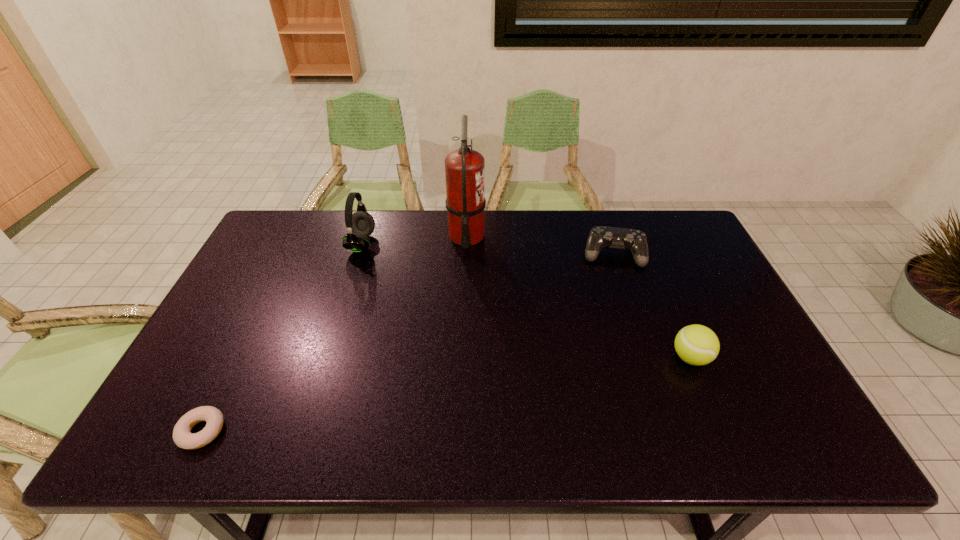
Locate an element on the screen. The width and height of the screenshot is (960, 540). free space located on the ear cups of the fourth object from right to left is located at coordinates (432, 244).

The width and height of the screenshot is (960, 540). Identify the location of free space located on the back of the second nearest object. (661, 289).

Image resolution: width=960 pixels, height=540 pixels. In order to click on vacant space situated 0.070m on the left of the fourth tallest object in this screenshot , I will do coord(562,255).

This screenshot has width=960, height=540. What are the coordinates of `vacant space positioned 0.360m on the right of the doughnut` in the screenshot? It's located at pos(385,431).

The width and height of the screenshot is (960, 540). In order to click on fire extinguisher positioned at the far edge in this screenshot , I will do `click(464, 168)`.

Image resolution: width=960 pixels, height=540 pixels. I want to click on headset that is at the far edge, so click(360, 225).

This screenshot has width=960, height=540. Identify the location of control that is at the far edge. (620, 238).

Find the location of `object at the near edge`. object at the near edge is located at coordinates (182, 436).

At what (x,y) coordinates should I click in order to perform the action: click on object at the left edge. Please return your answer as a coordinate pair (x, y). The width and height of the screenshot is (960, 540). Looking at the image, I should click on (182, 436).

Image resolution: width=960 pixels, height=540 pixels. Find the location of `object that is at the right edge`. object that is at the right edge is located at coordinates (698, 345).